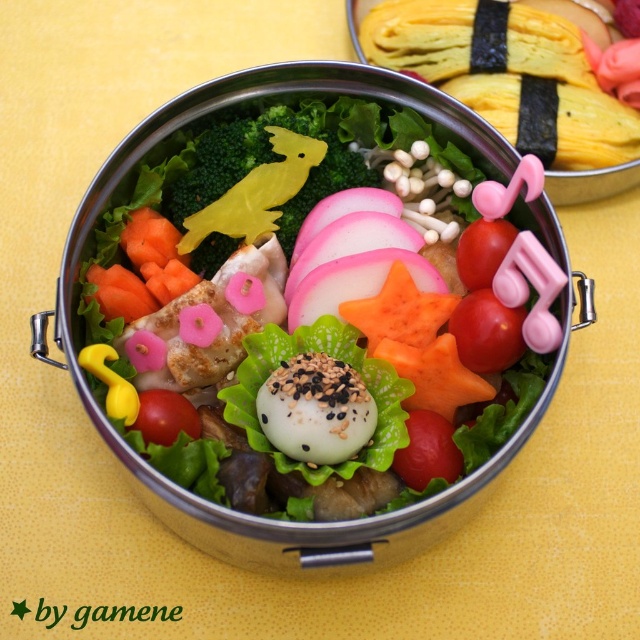
Which is more to the left, white glossy rice ball at center or green matte broccoli at center?

Positioned to the left is green matte broccoli at center.

Where is `white glossy rice ball at center`? white glossy rice ball at center is located at coordinates (316, 314).

The height and width of the screenshot is (640, 640). What are the coordinates of `white glossy rice ball at center` in the screenshot? It's located at (316, 314).

Between point (452, 282) and point (432, 273), which one is positioned behind?

The point (452, 282) is behind.

Locate an element on the screen. This screenshot has width=640, height=640. white glossy rice ball at center is located at coordinates (316, 314).

Who is positioned more to the left, green matte broccoli at center or pink translucent onion at center?

From the viewer's perspective, green matte broccoli at center appears more on the left side.

Is green matte broccoli at center wider than pink translucent onion at center?

Yes.

At what (x,y) coordinates should I click in order to perform the action: click on green matte broccoli at center. Please return your answer as a coordinate pair (x, y). This screenshot has height=640, width=640. Looking at the image, I should click on [x=269, y=176].

The height and width of the screenshot is (640, 640). What are the coordinates of `green matte broccoli at center` in the screenshot? It's located at (269, 176).